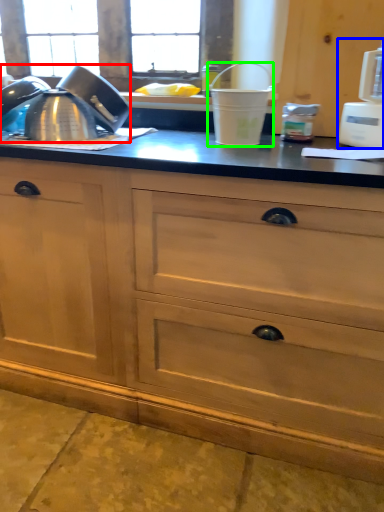
Question: Based on their relative distances, which object is nearer to tea pot (highlighted by a red box)? Choose from appliance (highlighted by a blue box) and appliance (highlighted by a green box).

Choices:
 (A) appliance
 (B) appliance

Answer: (B)